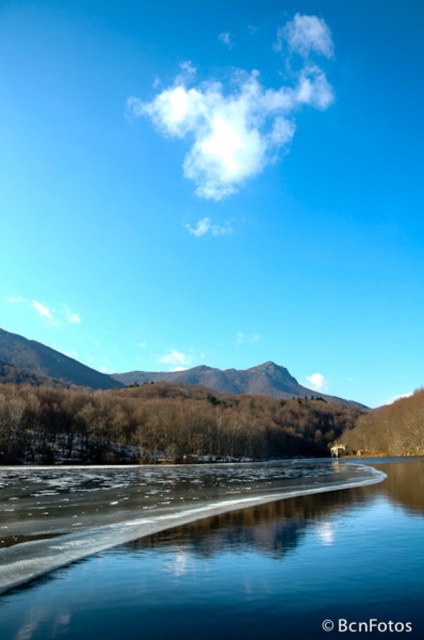
Question: Is brown matte trees at center wider than brown textured mountain at center?

Choices:
 (A) no
 (B) yes

Answer: (A)

Question: Which point is farther to the camera?

Choices:
 (A) (278, 364)
 (B) (407, 536)

Answer: (A)

Question: Does brown matte trees at center appear on the right side of brown textured mountain at center?

Choices:
 (A) no
 (B) yes

Answer: (A)

Question: From the image, what is the correct spatial relationship of transparent ice at lower center in relation to brown matte trees at center?

Choices:
 (A) above
 (B) below

Answer: (A)

Question: Which object is the farthest from the brown textured mountain at center?

Choices:
 (A) transparent ice at lower center
 (B) brown matte trees at center

Answer: (A)

Question: Which point is farther to the camera?

Choices:
 (A) brown textured mountain at center
 (B) brown matte trees at center

Answer: (A)